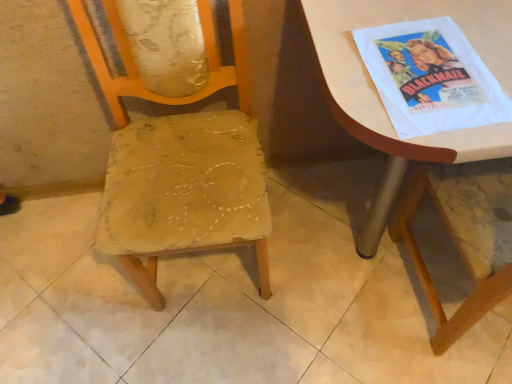
Question: From the image's perspective, is worn fabric chair at center above white glossy table at upper right?

Choices:
 (A) yes
 (B) no

Answer: (B)

Question: Is worn fabric chair at center wider than white glossy table at upper right?

Choices:
 (A) yes
 (B) no

Answer: (B)

Question: Is white glossy table at upper right completely or partially inside worn fabric chair at center?

Choices:
 (A) no
 (B) yes

Answer: (A)

Question: Is worn fabric chair at center looking in the opposite direction of white glossy table at upper right?

Choices:
 (A) yes
 (B) no

Answer: (B)

Question: Is worn fabric chair at center touching white glossy table at upper right?

Choices:
 (A) no
 (B) yes

Answer: (A)

Question: Looking at the image, does white glossy table at upper right seem bigger or smaller compared to white paper poster at upper right?

Choices:
 (A) small
 (B) big

Answer: (B)

Question: Based on their positions, is white glossy table at upper right located to the left or right of white paper poster at upper right?

Choices:
 (A) right
 (B) left

Answer: (A)

Question: Is white glossy table at upper right situated inside white paper poster at upper right or outside?

Choices:
 (A) outside
 (B) inside

Answer: (A)

Question: Is white glossy table at upper right in front of or behind white paper poster at upper right in the image?

Choices:
 (A) front
 (B) behind

Answer: (A)

Question: From the image's perspective, relative to white paper poster at upper right, is worn fabric chair at center above or below?

Choices:
 (A) above
 (B) below

Answer: (B)

Question: From a real-world perspective, is worn fabric chair at center positioned above or below white paper poster at upper right?

Choices:
 (A) below
 (B) above

Answer: (A)

Question: Considering the positions of worn fabric chair at center and white paper poster at upper right in the image, is worn fabric chair at center wider or thinner than white paper poster at upper right?

Choices:
 (A) wide
 (B) thin

Answer: (A)

Question: Considering their positions, is worn fabric chair at center located in front of or behind white paper poster at upper right?

Choices:
 (A) behind
 (B) front

Answer: (B)

Question: Considering the positions of white paper poster at upper right and worn fabric chair at center in the image, is white paper poster at upper right wider or thinner than worn fabric chair at center?

Choices:
 (A) wide
 (B) thin

Answer: (B)

Question: Considering the positions of point (499, 122) and point (254, 140), is point (499, 122) closer or farther from the camera than point (254, 140)?

Choices:
 (A) closer
 (B) farther

Answer: (A)